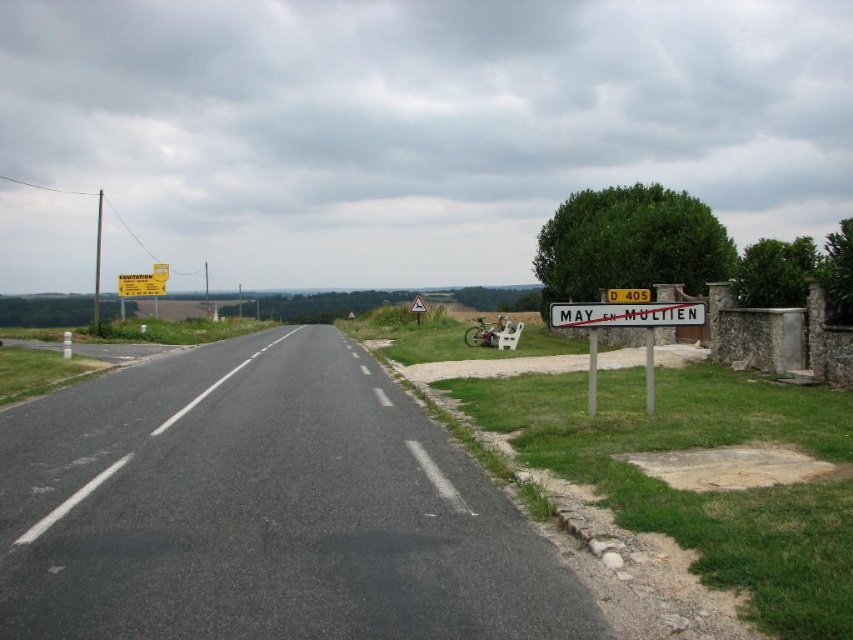
Does white plastic sign at right have a greater width compared to white plastic street sign at right?

Yes, white plastic sign at right is wider than white plastic street sign at right.

Locate an element on the screen. white plastic sign at right is located at coordinates (625, 326).

This screenshot has width=853, height=640. What do you see at coordinates (625, 326) in the screenshot?
I see `white plastic sign at right` at bounding box center [625, 326].

I want to click on white plastic sign at right, so click(625, 326).

Can you confirm if black asphalt road at center is smaller than white plastic sign at right?

Yes, black asphalt road at center is smaller than white plastic sign at right.

Between black asphalt road at center and white plastic sign at right, which one has less height?

black asphalt road at center

Is point (428, 460) farther from camera compared to point (624, 307)?

No, (428, 460) is closer to viewer.

Identify the location of black asphalt road at center. This screenshot has width=853, height=640. (263, 509).

Who is more distant from viewer, (215, 392) or (689, 317)?

The point (215, 392) is behind.

Consider the image. Who is higher up, black asphalt road at center or white plastic street sign at right?

white plastic street sign at right

Between point (368, 570) and point (575, 312), which one is positioned in front?

Point (368, 570) is in front.

Where is `black asphalt road at center`? This screenshot has width=853, height=640. black asphalt road at center is located at coordinates (263, 509).